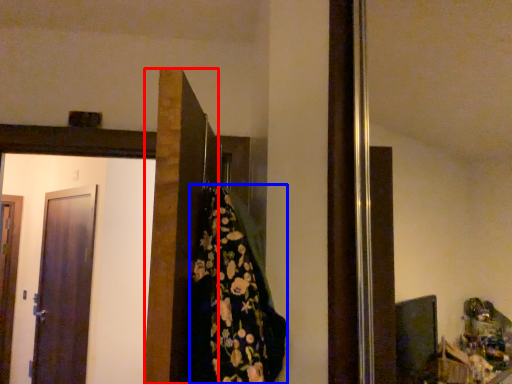
Question: Which object appears farthest to the camera in this image, door (highlighted by a red box) or blanket (highlighted by a blue box)?

Choices:
 (A) door
 (B) blanket

Answer: (B)